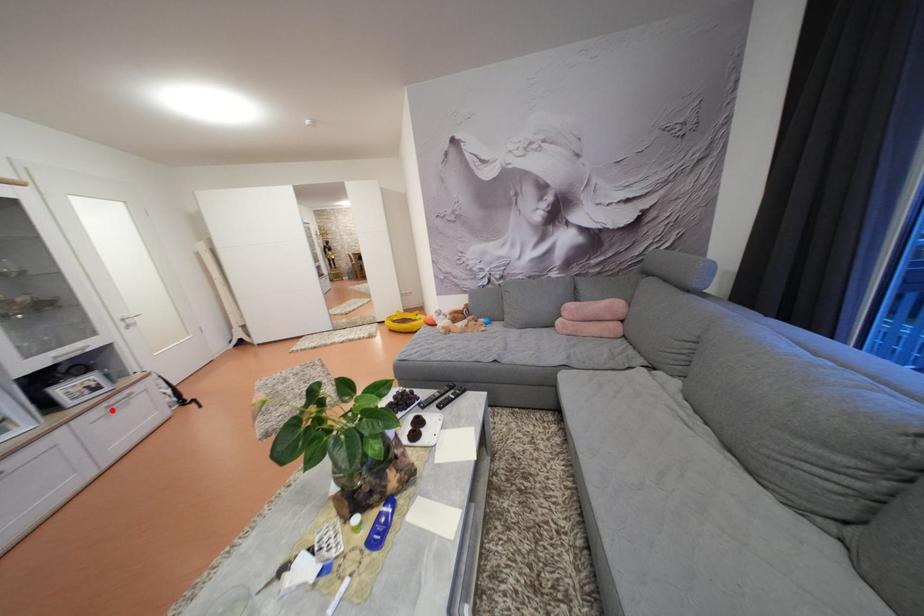
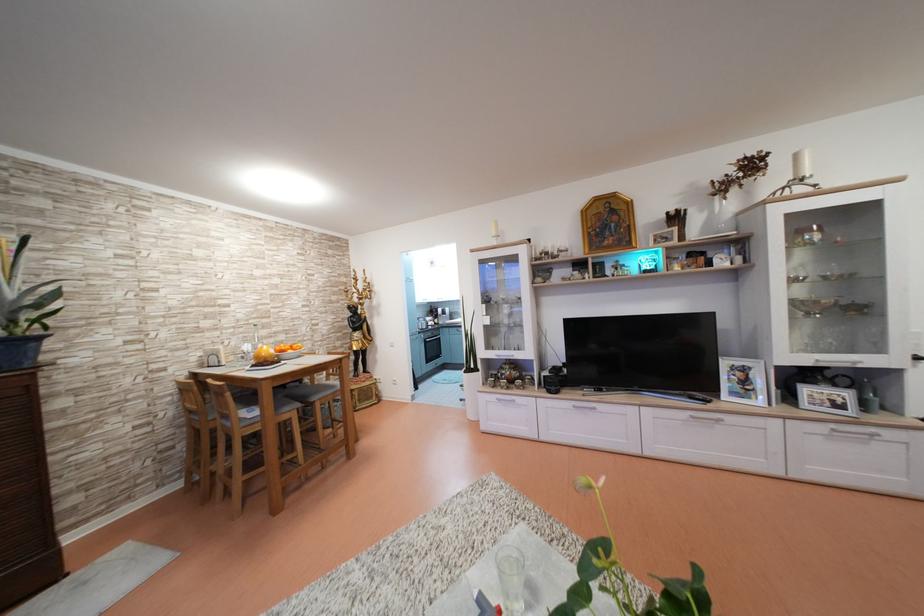
Question: I am providing you with two images of the same scene from different viewpoints. Image1 has a red point marked. In image2, the corresponding 3D location appears at what relative position? Reply with the corresponding letter.

Choices:
 (A) Closer
 (B) Farther

Answer: (A)